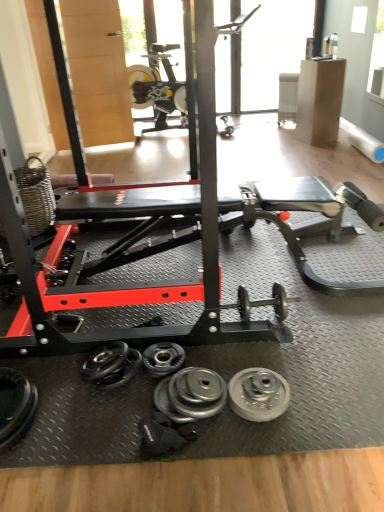
Identify the location of empty space that is ontop of silver metallic weight at center, the 1th wheel in the right-to-left sequence. (259, 387).